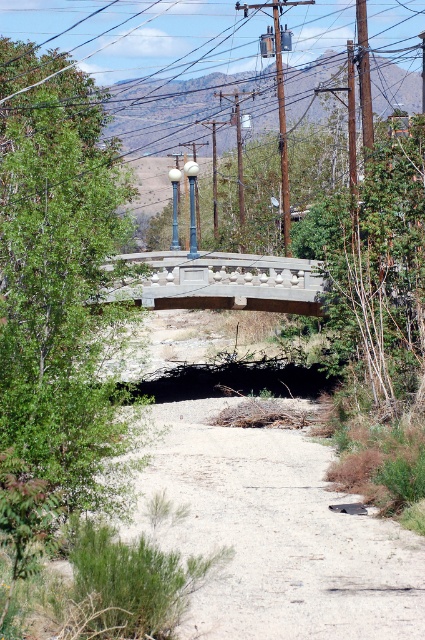
Question: Does gray concrete bridge at center have a larger size compared to matte gray pole at center?

Choices:
 (A) yes
 (B) no

Answer: (B)

Question: Which of the following is the closest to the observer?

Choices:
 (A) (277, 13)
 (B) (297, 300)
 (C) (189, 195)
 (D) (164, 522)

Answer: (D)

Question: Which point is closer to the camera?

Choices:
 (A) polished metal lamp post at center
 (B) dirt/gravel path at center
 (C) matte gray pole at center

Answer: (B)

Question: Which object is the closest to the matte gray pole at center?

Choices:
 (A) brown wooden telegraph pole at upper center
 (B) gray concrete bridge at center

Answer: (A)

Question: Can you confirm if dirt/gravel path at center is bigger than gray concrete bridge at center?

Choices:
 (A) yes
 (B) no

Answer: (B)

Question: Does polished metal lamp post at center come behind matte gray pole at center?

Choices:
 (A) yes
 (B) no

Answer: (B)